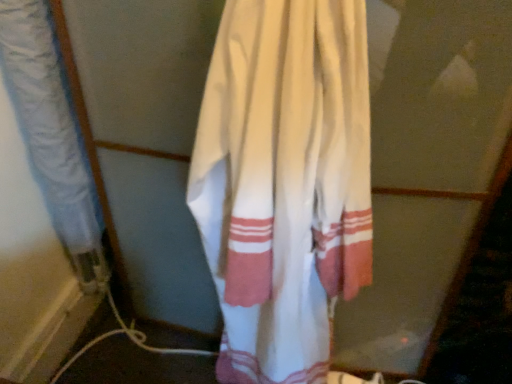
Question: From a real-world perspective, is white cotton towel at left, the 1th curtain viewed from the left, physically located above or below white cotton towel at center, placed as the 2th curtain when sorted from left to right?

Choices:
 (A) below
 (B) above

Answer: (B)

Question: Looking at the image, does white cotton towel at left, the second curtain viewed from the right, seem bigger or smaller compared to white cotton towel at center, placed as the 2th curtain when sorted from left to right?

Choices:
 (A) small
 (B) big

Answer: (A)

Question: Do you think white cotton towel at left, the second curtain viewed from the right, is within white cotton towel at center, acting as the first curtain starting from the right, or outside of it?

Choices:
 (A) outside
 (B) inside

Answer: (A)

Question: Is point (307, 276) closer or farther from the camera than point (14, 56)?

Choices:
 (A) farther
 (B) closer

Answer: (A)

Question: In the image, is white cotton towel at center, placed as the 2th curtain when sorted from left to right, positioned in front of or behind white cotton towel at left, the 1th curtain viewed from the left?

Choices:
 (A) front
 (B) behind

Answer: (A)

Question: Would you say white cotton towel at center, placed as the 2th curtain when sorted from left to right, is inside or outside white cotton towel at left, the second curtain viewed from the right?

Choices:
 (A) outside
 (B) inside

Answer: (A)

Question: Is white cotton towel at center, placed as the 2th curtain when sorted from left to right, taller or shorter than white cotton towel at left, the second curtain viewed from the right?

Choices:
 (A) tall
 (B) short

Answer: (A)